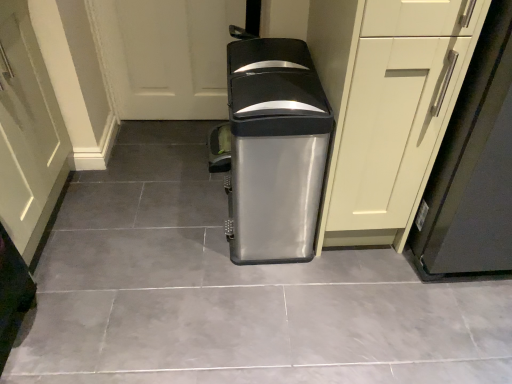
Describe the element at coordinates (28, 133) in the screenshot. The image size is (512, 384). I see `matte green door at lower left` at that location.

The image size is (512, 384). I want to click on matte white cabinet at right, so click(x=473, y=168).

Where is `matte white cabinet at center`? The width and height of the screenshot is (512, 384). matte white cabinet at center is located at coordinates (387, 106).

Is matte white cabinet at center positioned far away from matte white cabinet at right?

matte white cabinet at center is actually quite close to matte white cabinet at right.

Does matte white cabinet at center have a larger size compared to matte white cabinet at right?

Yes.

From the picture: Based on their positions, is satin metallic trash can at center located to the left or right of matte white cabinet at right?

satin metallic trash can at center is positioned on matte white cabinet at right's left side.

Which is correct: satin metallic trash can at center is inside matte white cabinet at right, or outside of it?

satin metallic trash can at center is outside matte white cabinet at right.

Which of these two, satin metallic trash can at center or matte white cabinet at right, is wider?

Wider between the two is satin metallic trash can at center.

Is satin metallic trash can at center oriented towards matte white cabinet at right?

No, satin metallic trash can at center is not facing towards matte white cabinet at right.

Who is taller, satin metallic trash can at center or matte white cabinet at center?

With more height is matte white cabinet at center.

Between satin metallic trash can at center and matte white cabinet at center, which one is positioned behind?

satin metallic trash can at center is further from the camera.

From the image's perspective, is satin metallic trash can at center under matte white cabinet at center?

Yes, from the image's perspective, satin metallic trash can at center is below matte white cabinet at center.

Is satin metallic trash can at center directly adjacent to matte white cabinet at center?

No, satin metallic trash can at center is not touching matte white cabinet at center.

Based on their positions, is matte green door at lower left located to the left or right of matte white cabinet at center?

From the image, it's evident that matte green door at lower left is to the left of matte white cabinet at center.

From the picture: Which of these two, matte green door at lower left or matte white cabinet at center, stands shorter?

With less height is matte green door at lower left.

From the image's perspective, is matte green door at lower left under matte white cabinet at center?

Yes, from the image's perspective, matte green door at lower left is below matte white cabinet at center.

Is point (22, 202) positioned in front of point (329, 68)?

No, (22, 202) is behind (329, 68).

Is matte white cabinet at right outside of satin metallic trash can at center?

Yes.

From a real-world perspective, is matte white cabinet at right positioned under satin metallic trash can at center based on gravity?

No.

Between matte white cabinet at right and satin metallic trash can at center, which one has larger width?

satin metallic trash can at center is wider.

Are matte white cabinet at right and satin metallic trash can at center beside each other?

No, matte white cabinet at right is not with satin metallic trash can at center.

The image size is (512, 384). I want to click on appliance that is above the matte green door at lower left (from a real-world perspective), so click(x=473, y=168).

Considering the sizes of matte green door at lower left and matte white cabinet at right in the image, is matte green door at lower left taller or shorter than matte white cabinet at right?

In the image, matte green door at lower left appears to be shorter than matte white cabinet at right.

What's the angular difference between matte green door at lower left and matte white cabinet at right's facing directions?

The angle between the facing direction of matte green door at lower left and the facing direction of matte white cabinet at right is 89.3 degrees.

Does matte green door at lower left turn towards matte white cabinet at right?

Yes.

Is point (298, 240) closer or farther from the camera than point (404, 218)?

Point (298, 240) is farther from the camera than point (404, 218).

Could you tell me if satin silver trash can at center is facing matte white cabinet at center?

No, satin silver trash can at center is not oriented towards matte white cabinet at center.

Looking at this image, is satin silver trash can at center at the left side of matte white cabinet at center?

Correct, you'll find satin silver trash can at center to the left of matte white cabinet at center.

Choose the correct answer: Is satin silver trash can at center inside matte white cabinet at center or outside it?

The correct answer is: outside.

Find the location of a particular element. The image size is (512, 384). cabinetry that appears above the matte white cabinet at right (from a real-world perspective) is located at coordinates (387, 106).

I want to click on concrete lying behind the matte white cabinet at right, so click(233, 292).

Estimate the real-world distances between objects in this image. Which object is closer to matte white cabinet at right, matte green door at lower left or satin metallic trash can at center?

satin metallic trash can at center is closer to matte white cabinet at right.

When comparing their distances from satin silver trash can at center, does matte green door at lower left or matte white cabinet at center seem further?

The object further to satin silver trash can at center is matte green door at lower left.

Based on their spatial positions, is matte white cabinet at right or satin silver trash can at center closer to matte white cabinet at center?

Among the two, matte white cabinet at right is located nearer to matte white cabinet at center.

Considering their positions, is matte white cabinet at right positioned further to satin metallic trash can at center than satin silver trash can at center?

The object further to satin metallic trash can at center is matte white cabinet at right.

When comparing their distances from satin silver trash can at center, does satin metallic trash can at center or matte white cabinet at center seem further?

satin metallic trash can at center.

Estimate the real-world distances between objects in this image. Which object is closer to matte white cabinet at right, satin metallic trash can at center or satin silver trash can at center?

Based on the image, satin silver trash can at center appears to be nearer to matte white cabinet at right.

Looking at the image, which one is located further to matte white cabinet at center, satin metallic trash can at center or matte green door at lower left?

Based on the image, matte green door at lower left appears to be further to matte white cabinet at center.

When comparing their distances from satin silver trash can at center, does matte white cabinet at center or matte white cabinet at right seem closer?

matte white cabinet at center.

I want to click on waste container situated between satin metallic trash can at center and matte white cabinet at right from left to right, so click(x=272, y=150).

Where is `waste container situated between satin metallic trash can at center and matte white cabinet at center from left to right`? Image resolution: width=512 pixels, height=384 pixels. waste container situated between satin metallic trash can at center and matte white cabinet at center from left to right is located at coordinates (272, 150).

Identify the location of cabinetry located between matte green door at lower left and matte white cabinet at right in the left-right direction. (387, 106).

The width and height of the screenshot is (512, 384). I want to click on cabinetry between satin silver trash can at center and matte white cabinet at right from left to right, so click(387, 106).